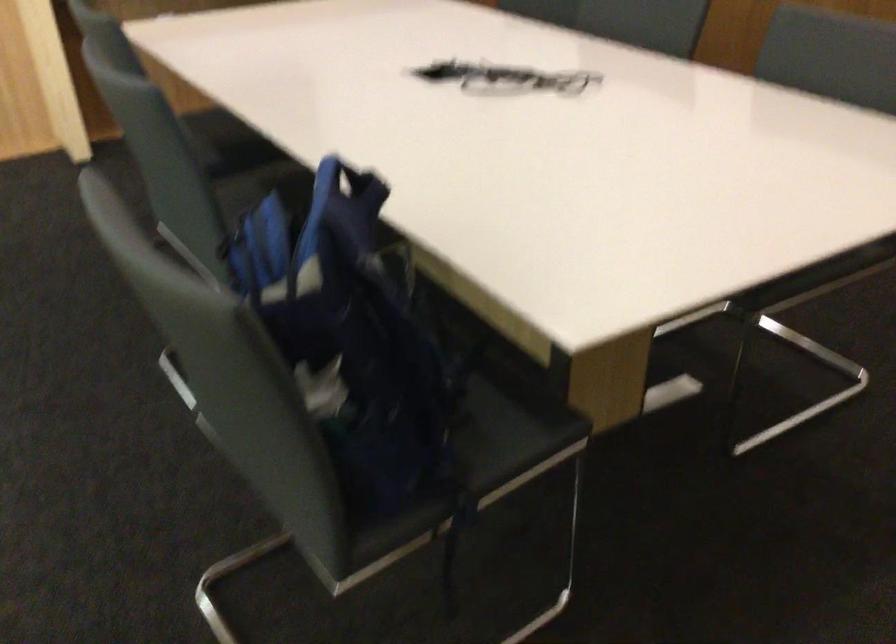
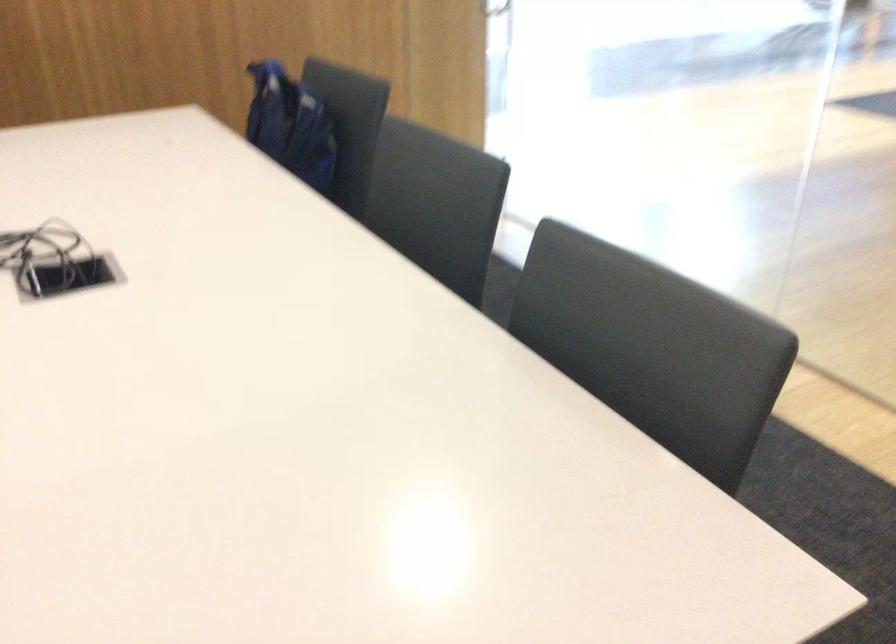
The point at (x=325, y=281) is marked in the first image. Where is the corresponding point in the second image?

(289, 125)